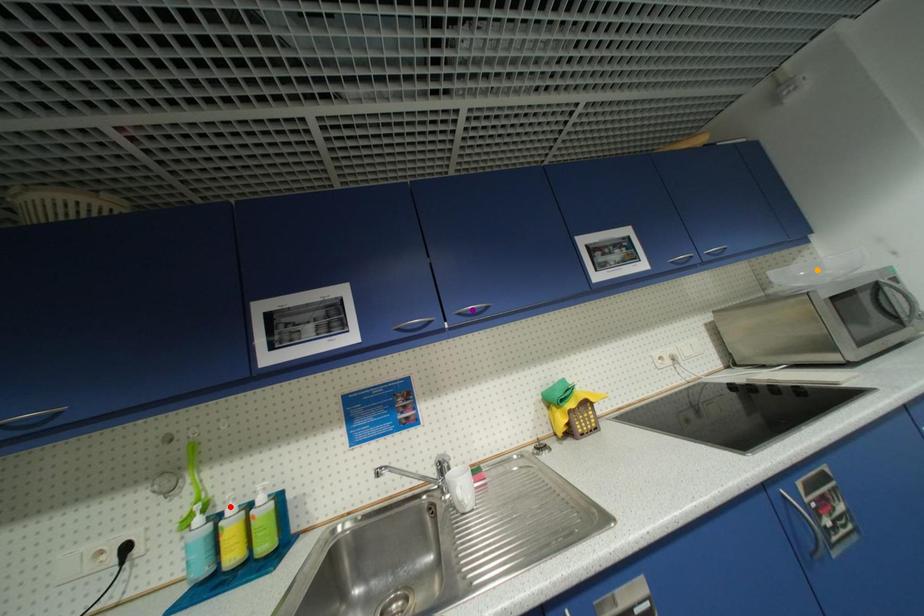
Order these from nearest to farthest:
- orange point
- red point
- purple point

red point < purple point < orange point